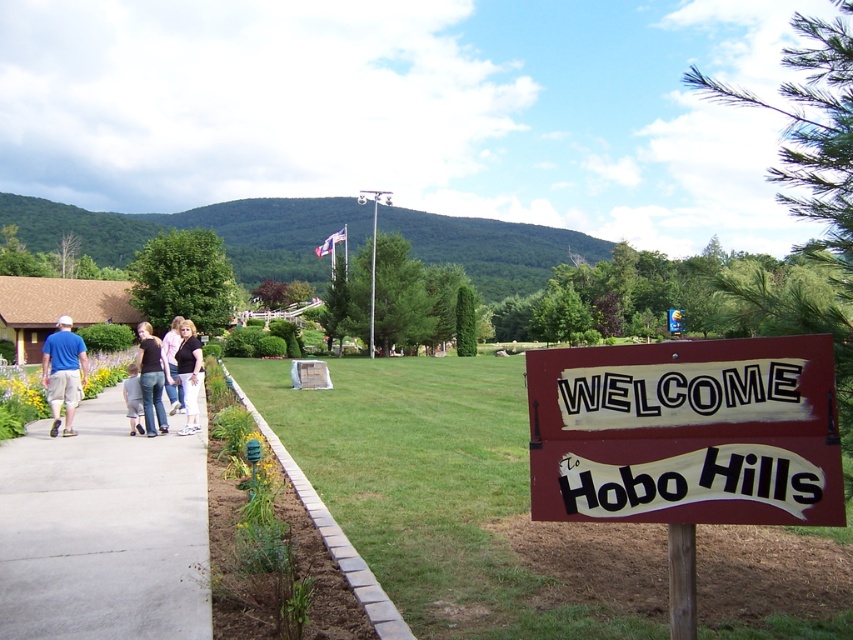
Is gray concrete sidewalk at lower left above white cotton shirt at left?

Incorrect, gray concrete sidewalk at lower left is not positioned above white cotton shirt at left.

Can you confirm if gray concrete sidewalk at lower left is positioned to the right of white cotton shirt at left?

Correct, you'll find gray concrete sidewalk at lower left to the right of white cotton shirt at left.

The height and width of the screenshot is (640, 853). What are the coordinates of `gray concrete sidewalk at lower left` in the screenshot? It's located at (102, 531).

In the scene shown: Between denim jeans at left and matte black shirt at center, which one appears on the left side from the viewer's perspective?

denim jeans at left is more to the left.

Can you confirm if denim jeans at left is positioned above matte black shirt at center?

No, denim jeans at left is not above matte black shirt at center.

Which is behind, point (138, 346) or point (184, 387)?

The point (138, 346) is more distant.

The image size is (853, 640). I want to click on denim jeans at left, so click(151, 378).

Is gray concrete sidewalk at lower left to the left of denim jeans at left from the viewer's perspective?

Incorrect, gray concrete sidewalk at lower left is not on the left side of denim jeans at left.

Between gray concrete sidewalk at lower left and denim jeans at left, which one appears on the left side from the viewer's perspective?

From the viewer's perspective, denim jeans at left appears more on the left side.

Is point (83, 593) closer to viewer compared to point (143, 403)?

Yes, point (83, 593) is closer to viewer.

Identify the location of gray concrete sidewalk at lower left. The width and height of the screenshot is (853, 640). (102, 531).